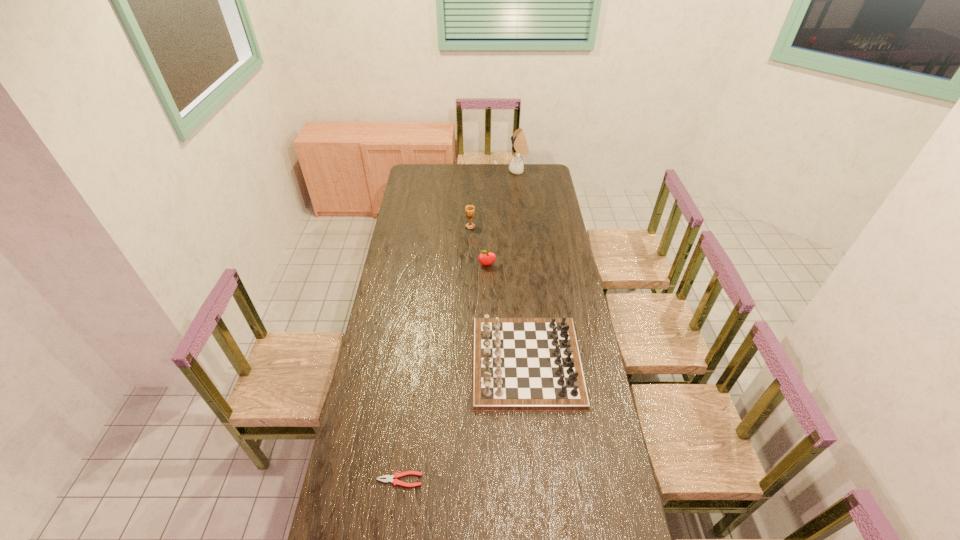
The width and height of the screenshot is (960, 540). Identify the location of doll. click(519, 144).

The image size is (960, 540). What are the coordinates of `the farthest object` in the screenshot? It's located at (519, 144).

Where is `chalice`? chalice is located at coordinates (469, 209).

The image size is (960, 540). Identify the location of the second nearest object. (518, 364).

Where is `apple`? Image resolution: width=960 pixels, height=540 pixels. apple is located at coordinates (485, 258).

At what (x,y) coordinates should I click in order to perform the action: click on pliers. Please return your answer as a coordinate pair (x, y). The height and width of the screenshot is (540, 960). Looking at the image, I should click on (389, 478).

The height and width of the screenshot is (540, 960). I want to click on the nearest object, so click(x=389, y=478).

Image resolution: width=960 pixels, height=540 pixels. Identify the location of free space located at the front face of the tallest object. (455, 171).

Identify the location of vacant region located 0.140m at the front face of the tallest object. This screenshot has height=540, width=960. (488, 171).

The image size is (960, 540). I want to click on free spot located at the front face of the tallest object, so click(475, 171).